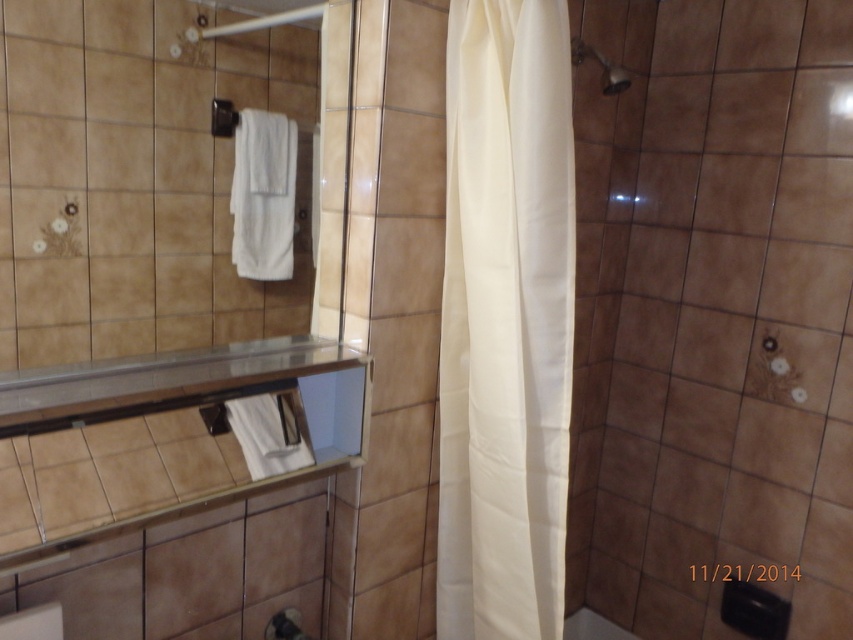
Is the position of white fabric shower curtain at center more distant than that of matte silver shower head at upper right?

No, white fabric shower curtain at center is in front of matte silver shower head at upper right.

Is white fabric shower curtain at center bigger than matte silver shower head at upper right?

Yes, white fabric shower curtain at center is bigger than matte silver shower head at upper right.

Measure the distance between white fabric shower curtain at center and camera.

The distance of white fabric shower curtain at center from camera is 1.08 meters.

Identify the location of white fabric shower curtain at center. (x=505, y=321).